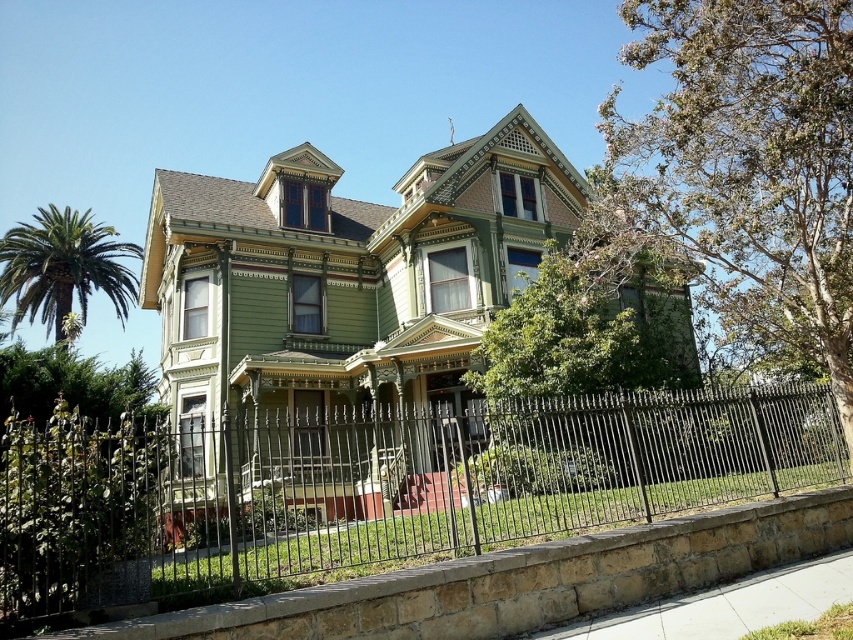
Question: Can you confirm if black wrought iron fence at center is positioned below green leafy palm tree at left?

Choices:
 (A) no
 (B) yes

Answer: (B)

Question: In this image, where is black wrought iron fence at center located relative to green leafy palm tree at left?

Choices:
 (A) left
 (B) right

Answer: (B)

Question: Which of the following is the farthest from the observer?

Choices:
 (A) (19, 307)
 (B) (627, 396)

Answer: (A)

Question: Which object is closer to the camera taking this photo?

Choices:
 (A) black wrought iron fence at center
 (B) green leafy palm tree at left

Answer: (A)

Question: Is black wrought iron fence at center wider than green leafy palm tree at left?

Choices:
 (A) no
 (B) yes

Answer: (A)